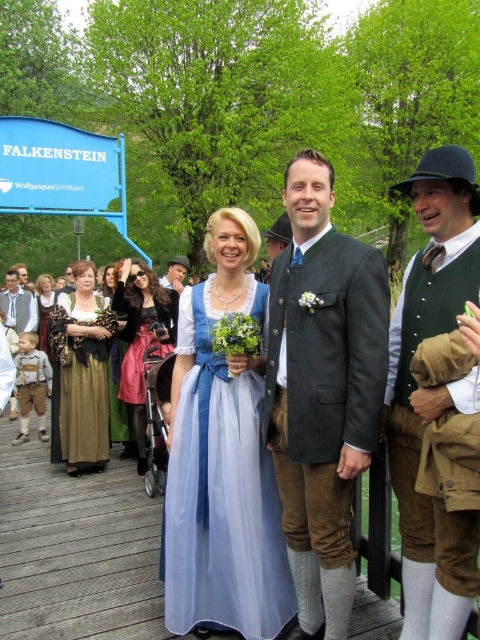
You are a GUI agent. You are given a task and a screenshot of the screen. Output one action in this format:
    pyautogui.click(x=<x>, y=<y>)
    Task: Click on the gold brocade dress at left
    The width and height of the screenshot is (480, 640).
    Given the screenshot: What is the action you would take?
    pyautogui.click(x=83, y=371)

Who is more distant from viewer, (101, 328) or (24, 296)?

The point (24, 296) is behind.

Between point (96, 403) and point (12, 307), which one is positioned behind?

The point (12, 307) is more distant.

You are a GUI agent. You are given a task and a screenshot of the screen. Output one action in this format:
    pyautogui.click(x=<x>, y=<y>)
    Task: Click on the gold brocade dress at left
    The height and width of the screenshot is (640, 480).
    Given the screenshot: What is the action you would take?
    pyautogui.click(x=83, y=371)

Can you confirm if gold brocade dress at left is positioned below matte brown dress at center?

Yes, gold brocade dress at left is below matte brown dress at center.

Can you confirm if gold brocade dress at left is positioned to the left of matte brown dress at center?

No, gold brocade dress at left is not to the left of matte brown dress at center.

Who is more forward, (x=70, y=472) or (x=106, y=278)?

Point (x=70, y=472)

Locate an element on the screen. The height and width of the screenshot is (640, 480). gold brocade dress at left is located at coordinates (83, 371).

This screenshot has width=480, height=640. Describe the element at coordinates (83, 371) in the screenshot. I see `gold brocade dress at left` at that location.

In the scene shown: Is gold brocade dress at left to the right of velvet pink dress at center from the viewer's perspective?

No, gold brocade dress at left is not to the right of velvet pink dress at center.

Between point (66, 445) and point (134, 422), which one is positioned behind?

The point (134, 422) is behind.

You are a GUI agent. You are given a task and a screenshot of the screen. Output one action in this format:
    pyautogui.click(x=<x>, y=<y>)
    Task: Click on the gold brocade dress at left
    This screenshot has height=640, width=480.
    Given the screenshot: What is the action you would take?
    pyautogui.click(x=83, y=371)